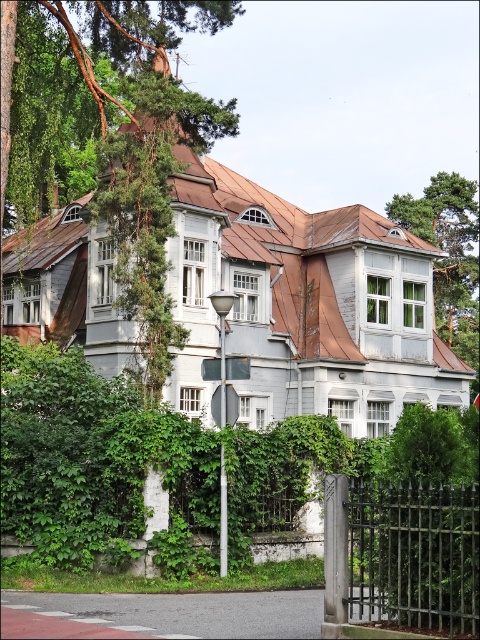
Question: Which object is farther from the camera taking this photo?

Choices:
 (A) metallic pole at center
 (B) green leafy tree at left

Answer: (B)

Question: Which of these objects is positioned closest to the black wrought iron gate at center?

Choices:
 (A) green leafy tree at upper right
 (B) metallic pole at center

Answer: (B)

Question: Is green leafy tree at left bigger than green leafy tree at upper right?

Choices:
 (A) yes
 (B) no

Answer: (A)

Question: Is black wrought iron gate at center to the left of metallic pole at center from the viewer's perspective?

Choices:
 (A) no
 (B) yes

Answer: (A)

Question: Is green leafy tree at left further to camera compared to green leafy tree at upper right?

Choices:
 (A) yes
 (B) no

Answer: (B)

Question: Which point is farther to the camera?

Choices:
 (A) (430, 545)
 (B) (220, 330)
 (C) (40, 163)
 (D) (395, 198)

Answer: (D)